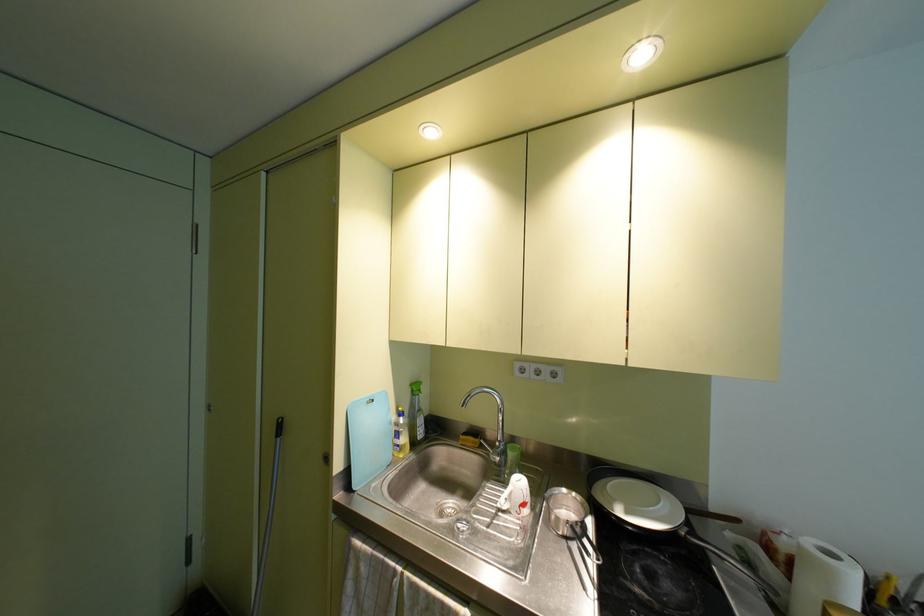
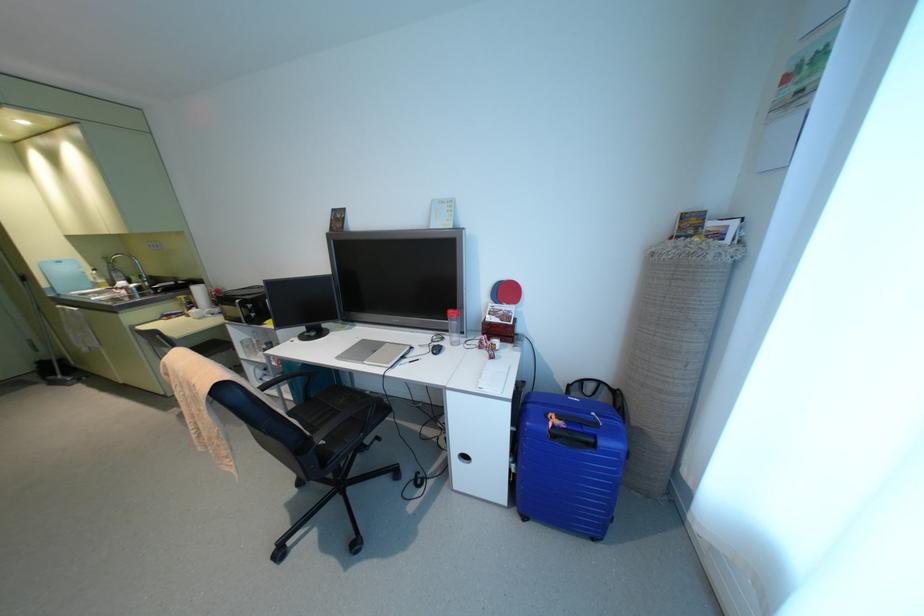
What movement of the cameraman would produce the second image?

The cameraman moved toward right, backward.